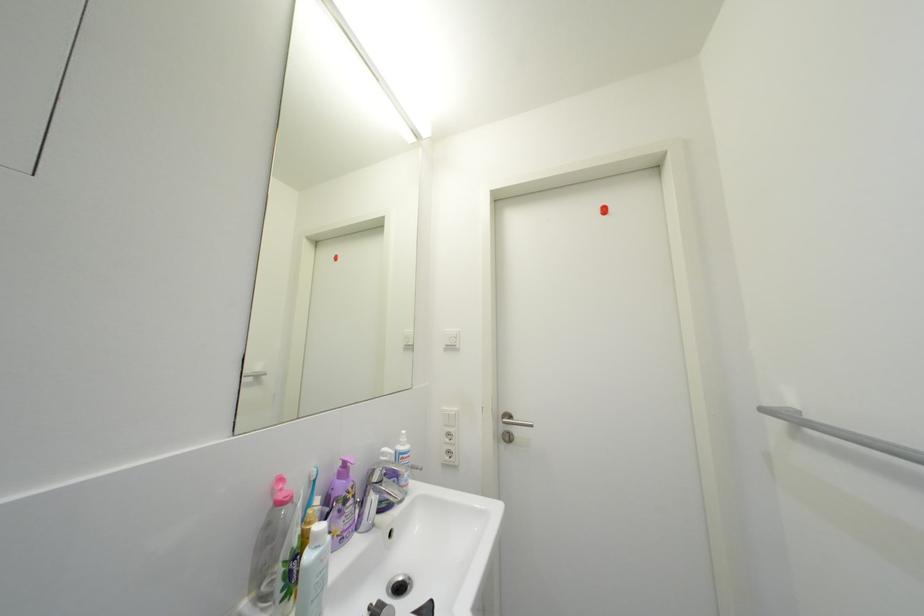
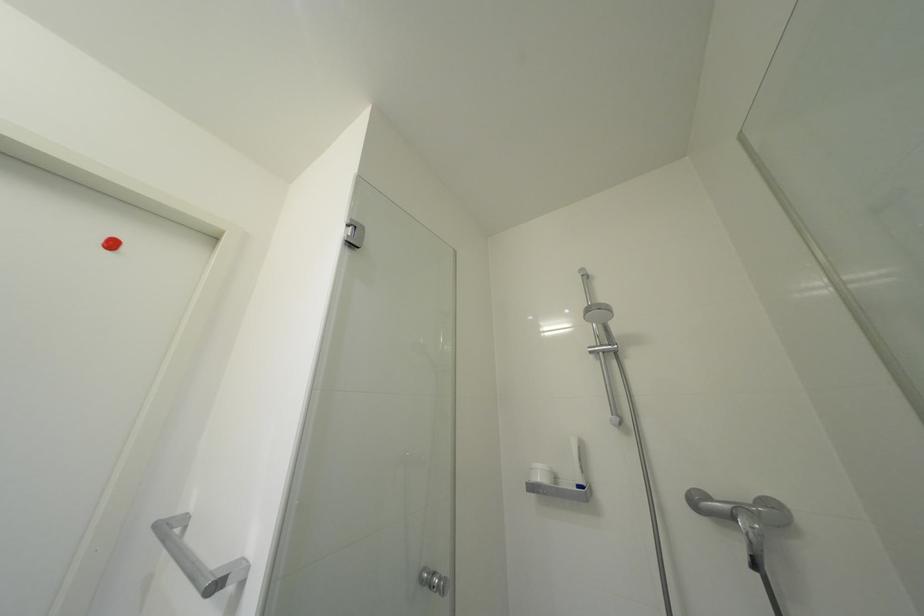
In the scene shown: The first image is from the beginning of the video and the second image is from the end. How did the camera likely rotate when shooting the video?

The camera rotated toward right-up.